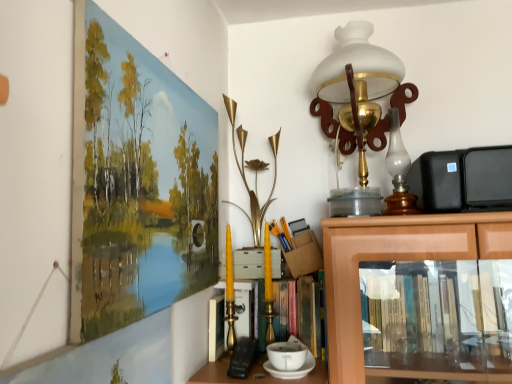
What do you see at coordinates (136, 181) in the screenshot? Image resolution: width=512 pixels, height=384 pixels. I see `wooden picture frame at upper left` at bounding box center [136, 181].

Locate an element on the screen. wooden picture frame at upper left is located at coordinates (136, 181).

The width and height of the screenshot is (512, 384). Describe the element at coordinates (358, 84) in the screenshot. I see `white frosted glass table lamp at upper right` at that location.

This screenshot has width=512, height=384. What are the coordinates of `white frosted glass table lamp at upper right` in the screenshot? It's located at (358, 84).

Measure the distance between white frosted glass table lamp at upper right and camera.

They are 3.29 feet apart.

The width and height of the screenshot is (512, 384). I want to click on wooden picture frame at upper left, so click(136, 181).

Consider the image. Considering the positions of objects wooden picture frame at upper left and white frosted glass table lamp at upper right in the image provided, who is more to the left, wooden picture frame at upper left or white frosted glass table lamp at upper right?

Positioned to the left is wooden picture frame at upper left.

In the scene shown: Which object is further away from the camera, wooden picture frame at upper left or white frosted glass table lamp at upper right?

white frosted glass table lamp at upper right.

Does point (128, 239) appear closer or farther from the camera than point (364, 113)?

Point (128, 239) is positioned closer to the camera compared to point (364, 113).

From the image's perspective, would you say wooden picture frame at upper left is positioned over white frosted glass table lamp at upper right?

No, from the image's perspective, wooden picture frame at upper left is not above white frosted glass table lamp at upper right.

From a real-world perspective, who is located lower, wooden picture frame at upper left or white frosted glass table lamp at upper right?

wooden picture frame at upper left is physically lower.

Is wooden picture frame at upper left wider than white frosted glass table lamp at upper right?

No.

Considering the relative sizes of wooden picture frame at upper left and white frosted glass table lamp at upper right in the image provided, is wooden picture frame at upper left shorter than white frosted glass table lamp at upper right?

Yes, wooden picture frame at upper left is shorter than white frosted glass table lamp at upper right.

Based on their sizes in the image, would you say wooden picture frame at upper left is bigger or smaller than white frosted glass table lamp at upper right?

Considering their sizes, wooden picture frame at upper left takes up less space than white frosted glass table lamp at upper right.

Is wooden picture frame at upper left completely or partially outside of white frosted glass table lamp at upper right?

Yes, wooden picture frame at upper left is not within white frosted glass table lamp at upper right.

Is wooden picture frame at upper left far from white frosted glass table lamp at upper right?

No, wooden picture frame at upper left is in close proximity to white frosted glass table lamp at upper right.

Is wooden picture frame at upper left looking in the opposite direction of white frosted glass table lamp at upper right?

wooden picture frame at upper left does not have its back to white frosted glass table lamp at upper right.

What's the angular difference between wooden picture frame at upper left and white frosted glass table lamp at upper right's facing directions?

There is a 88.3-degree angle between the facing directions of wooden picture frame at upper left and white frosted glass table lamp at upper right.

Where is `picture frame that is in front of the white frosted glass table lamp at upper right`? The width and height of the screenshot is (512, 384). picture frame that is in front of the white frosted glass table lamp at upper right is located at coordinates (136, 181).

In the scene shown: Which is more to the right, white frosted glass table lamp at upper right or wooden picture frame at upper left?

Positioned to the right is white frosted glass table lamp at upper right.

Is white frosted glass table lamp at upper right in front of wooden picture frame at upper left?

No, white frosted glass table lamp at upper right is behind wooden picture frame at upper left.

Considering the points (342, 61) and (142, 175), which point is behind, point (342, 61) or point (142, 175)?

The point (342, 61) is farther.

Consider the image. From the image's perspective, is white frosted glass table lamp at upper right on wooden picture frame at upper left?

Yes, from the image's perspective, white frosted glass table lamp at upper right is over wooden picture frame at upper left.

From a real-world perspective, is white frosted glass table lamp at upper right physically above wooden picture frame at upper left?

Yes.

Which object is thinner, white frosted glass table lamp at upper right or wooden picture frame at upper left?

wooden picture frame at upper left is thinner.

Between white frosted glass table lamp at upper right and wooden picture frame at upper left, which one has less height?

wooden picture frame at upper left.

Considering the relative sizes of white frosted glass table lamp at upper right and wooden picture frame at upper left in the image provided, is white frosted glass table lamp at upper right smaller than wooden picture frame at upper left?

Actually, white frosted glass table lamp at upper right might be larger than wooden picture frame at upper left.

In the scene shown: Would you say white frosted glass table lamp at upper right is outside wooden picture frame at upper left?

Yes.

Are white frosted glass table lamp at upper right and wooden picture frame at upper left beside each other?

No, white frosted glass table lamp at upper right is not touching wooden picture frame at upper left.

Based on the photo, is white frosted glass table lamp at upper right aimed at wooden picture frame at upper left?

No, white frosted glass table lamp at upper right is not aimed at wooden picture frame at upper left.

Identify the location of picture frame in front of the white frosted glass table lamp at upper right. The height and width of the screenshot is (384, 512). (136, 181).

Image resolution: width=512 pixels, height=384 pixels. I want to click on table lamp behind the wooden picture frame at upper left, so click(x=358, y=84).

The image size is (512, 384). I want to click on picture frame below the white frosted glass table lamp at upper right (from a real-world perspective), so click(x=136, y=181).